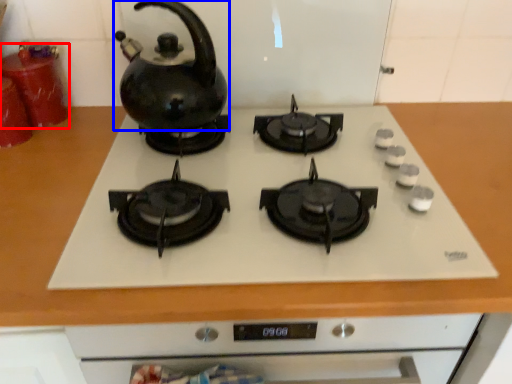
Question: Which object appears farthest to the camera in this image, kitchen appliance (highlighted by a red box) or kettle (highlighted by a blue box)?

Choices:
 (A) kitchen appliance
 (B) kettle

Answer: (A)